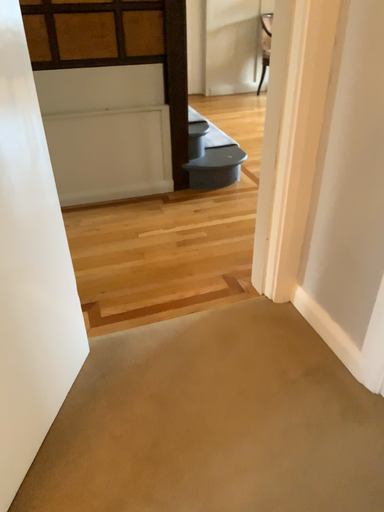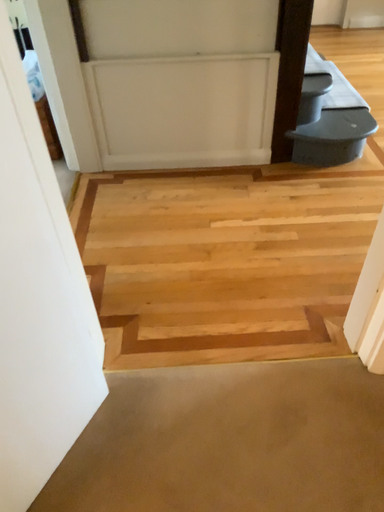
Question: How did the camera likely rotate when shooting the video?

Choices:
 (A) rotated left
 (B) rotated right

Answer: (A)